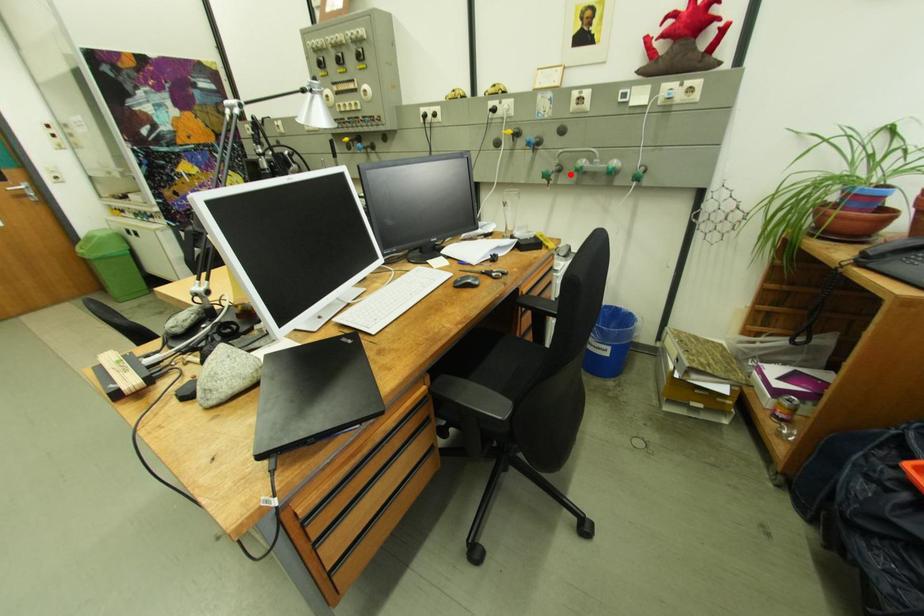
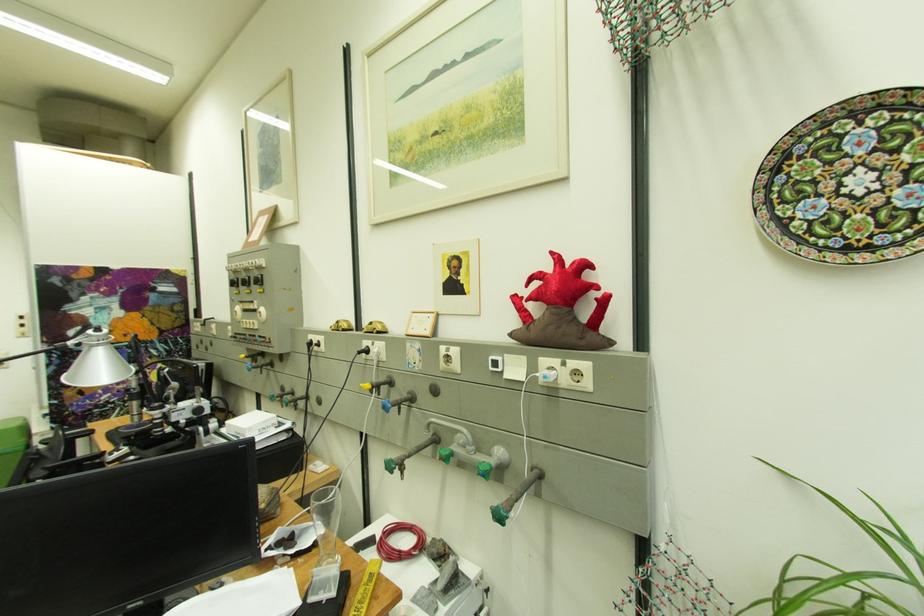
Question: I am providing you with two images of the same scene from different viewpoints. Image1 has a red point marked. In image2, the corresponding 3D location appears at what relative position? Reply with the corresponding letter.

Choices:
 (A) Closer
 (B) Farther

Answer: (B)